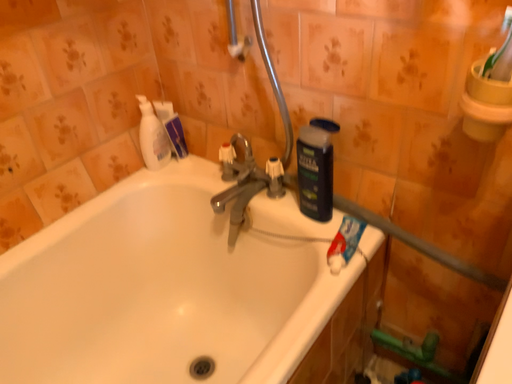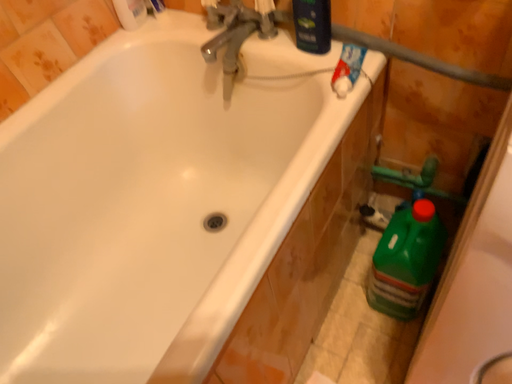
Question: Which way did the camera rotate in the video?

Choices:
 (A) rotated downward
 (B) rotated upward

Answer: (A)